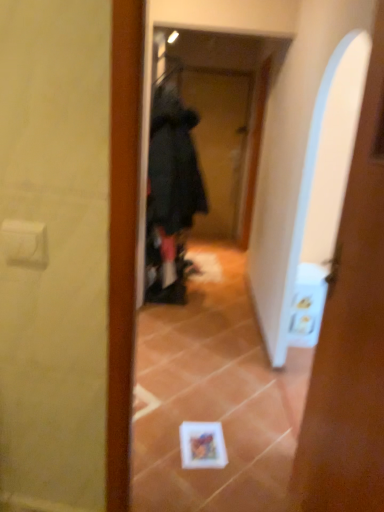
Question: Considering the relative sizes of black fuzzy bathrobe at center and white glossy door at center in the image provided, is black fuzzy bathrobe at center shorter than white glossy door at center?

Choices:
 (A) no
 (B) yes

Answer: (B)

Question: Is black fuzzy bathrobe at center bigger than white glossy door at center?

Choices:
 (A) yes
 (B) no

Answer: (A)

Question: Considering the relative positions of black fuzzy bathrobe at center and white glossy door at center in the image provided, is black fuzzy bathrobe at center behind white glossy door at center?

Choices:
 (A) no
 (B) yes

Answer: (B)

Question: Can you confirm if black fuzzy bathrobe at center is thinner than white glossy door at center?

Choices:
 (A) no
 (B) yes

Answer: (A)

Question: Is black fuzzy bathrobe at center not inside white glossy door at center?

Choices:
 (A) no
 (B) yes

Answer: (B)

Question: Is black fuzzy bathrobe at center taller than white glossy door at center?

Choices:
 (A) no
 (B) yes

Answer: (A)

Question: Is black fabric screen door at center aimed at white glossy door at center?

Choices:
 (A) no
 (B) yes

Answer: (B)

Question: Is black fabric screen door at center bigger than white glossy door at center?

Choices:
 (A) no
 (B) yes

Answer: (B)

Question: From the image's perspective, is black fabric screen door at center under white glossy door at center?

Choices:
 (A) yes
 (B) no

Answer: (B)

Question: From the image's perspective, is black fabric screen door at center above white glossy door at center?

Choices:
 (A) no
 (B) yes

Answer: (B)

Question: Considering the relative sizes of black fabric screen door at center and white glossy door at center in the image provided, is black fabric screen door at center taller than white glossy door at center?

Choices:
 (A) no
 (B) yes

Answer: (B)

Question: Does black fabric screen door at center touch white glossy door at center?

Choices:
 (A) yes
 (B) no

Answer: (B)

Question: From the image's perspective, is white glossy door at center on black fabric screen door at center?

Choices:
 (A) no
 (B) yes

Answer: (A)